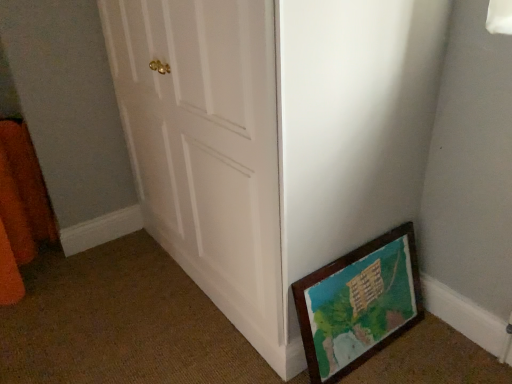
Question: From a real-world perspective, is white wooden door at center located higher than orange fuzzy curtain at left?

Choices:
 (A) yes
 (B) no

Answer: (A)

Question: Is white wooden door at center to the right of orange fuzzy curtain at left from the viewer's perspective?

Choices:
 (A) no
 (B) yes

Answer: (B)

Question: Does white wooden door at center have a smaller size compared to orange fuzzy curtain at left?

Choices:
 (A) no
 (B) yes

Answer: (A)

Question: Can you confirm if white wooden door at center is shorter than orange fuzzy curtain at left?

Choices:
 (A) no
 (B) yes

Answer: (A)

Question: Is white wooden door at center to the left of orange fuzzy curtain at left from the viewer's perspective?

Choices:
 (A) yes
 (B) no

Answer: (B)

Question: Considering the relative sizes of white wooden door at center and orange fuzzy curtain at left in the image provided, is white wooden door at center bigger than orange fuzzy curtain at left?

Choices:
 (A) yes
 (B) no

Answer: (A)

Question: From a real-world perspective, is orange fuzzy curtain at left positioned under white wooden door at center based on gravity?

Choices:
 (A) yes
 (B) no

Answer: (A)

Question: Is white wooden door at center inside orange fuzzy curtain at left?

Choices:
 (A) no
 (B) yes

Answer: (A)

Question: From the image's perspective, would you say orange fuzzy curtain at left is positioned over white wooden door at center?

Choices:
 (A) no
 (B) yes

Answer: (A)

Question: Does orange fuzzy curtain at left lie in front of white wooden door at center?

Choices:
 (A) no
 (B) yes

Answer: (A)

Question: Is orange fuzzy curtain at left looking in the opposite direction of white wooden door at center?

Choices:
 (A) no
 (B) yes

Answer: (A)

Question: From the image's perspective, does orange fuzzy curtain at left appear lower than white wooden door at center?

Choices:
 (A) no
 (B) yes

Answer: (B)

Question: Is wooden picture frame at lower right taller than orange fuzzy curtain at left?

Choices:
 (A) no
 (B) yes

Answer: (A)